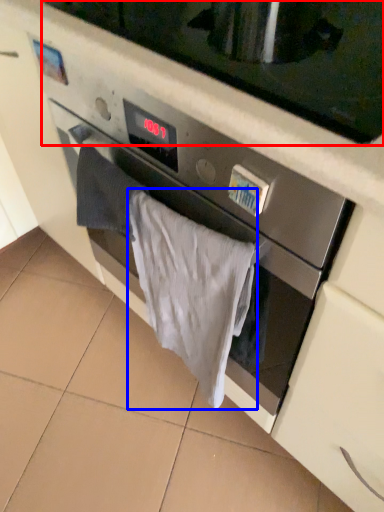
Question: Which of the following is the closest to the observer, microwave oven (highlighted by a red box) or bath towel (highlighted by a blue box)?

Choices:
 (A) microwave oven
 (B) bath towel

Answer: (A)